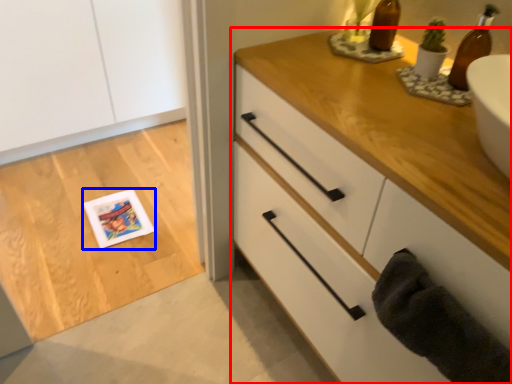
Question: Which of the following is the farthest to the observer, chest of drawers (highlighted by a red box) or postcard (highlighted by a blue box)?

Choices:
 (A) chest of drawers
 (B) postcard

Answer: (B)